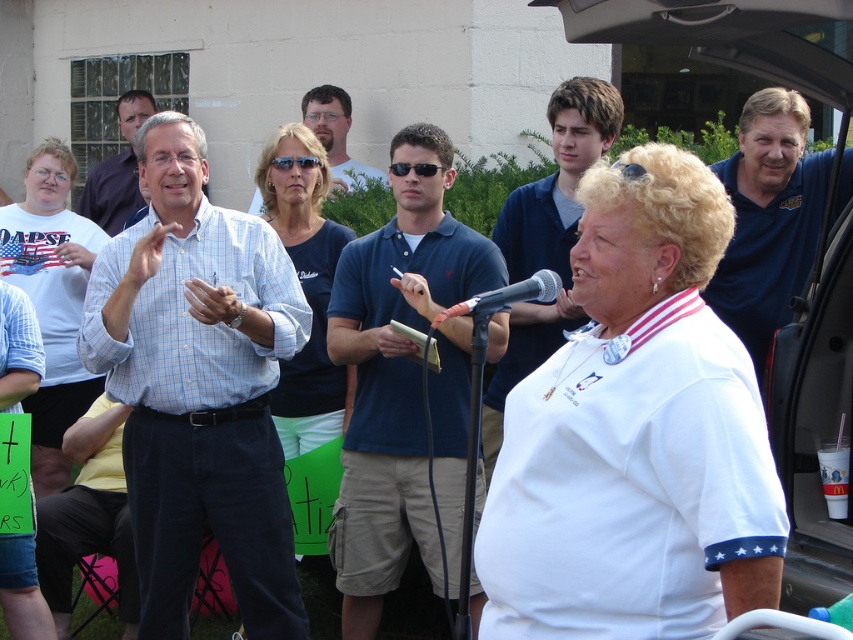
Can you confirm if light blue plaid shirt at center is bigger than yellow shirt at lower left?

Yes, light blue plaid shirt at center is bigger than yellow shirt at lower left.

Is point (282, 544) farther from viewer compared to point (67, 605)?

No, it is in front of (67, 605).

Where is `light blue plaid shirt at center`? light blue plaid shirt at center is located at coordinates (x=198, y=387).

Locate an element on the screen. light blue plaid shirt at center is located at coordinates (198, 387).

At what (x,y) coordinates should I click in order to perform the action: click on light blue plaid shirt at center. Please return your answer as a coordinate pair (x, y). The width and height of the screenshot is (853, 640). Looking at the image, I should click on (198, 387).

Who is lower down, light blue plaid shirt at center or black plastic microphone at center?

light blue plaid shirt at center is lower down.

Measure the distance between light blue plaid shirt at center and camera.

The distance of light blue plaid shirt at center from camera is 14.74 feet.

What are the coordinates of `light blue plaid shirt at center` in the screenshot? It's located at (198, 387).

Between light blue shirt at center and black plastic microphone at center, which one has less height?

black plastic microphone at center is shorter.

Does point (97, 170) come farther from viewer compared to point (550, 282)?

Yes, point (97, 170) is farther from viewer.

Measure the distance between light blue shirt at center and camera.

light blue shirt at center and camera are 8.65 meters apart from each other.

Locate an element on the screen. This screenshot has height=640, width=853. light blue shirt at center is located at coordinates (117, 170).